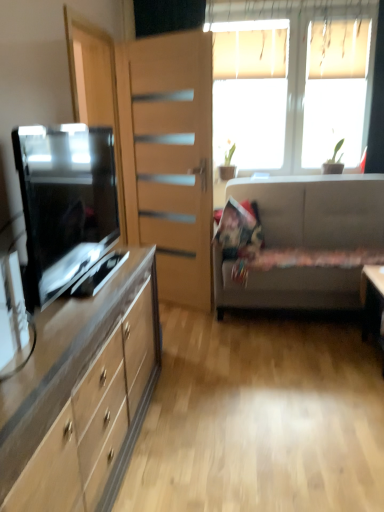
Identify the location of white fabric couch at right. (317, 210).

Describe the element at coordinates (317, 210) in the screenshot. I see `white fabric couch at right` at that location.

At what (x,y) coordinates should I click in order to perform the action: click on matte wood file cabinet at left. Please return your answer as a coordinate pair (x, y). Image resolution: width=384 pixels, height=512 pixels. Looking at the image, I should click on (169, 158).

I want to click on green matte plant at upper center, so click(227, 164).

This screenshot has width=384, height=512. What do you see at coordinates (82, 396) in the screenshot?
I see `matte wood cabinet at left` at bounding box center [82, 396].

Where is `white plastic window at upper right`? This screenshot has width=384, height=512. white plastic window at upper right is located at coordinates (302, 53).

From the image's perspective, is green matte plant at upper center above or below white fabric couch at right?

Based on their image positions, green matte plant at upper center is located above white fabric couch at right.

Is green matte plant at upper center thinner than white fabric couch at right?

Indeed, green matte plant at upper center has a lesser width compared to white fabric couch at right.

Is green matte plant at upper center turned away from white fabric couch at right?

No, green matte plant at upper center is not facing the opposite direction of white fabric couch at right.

I want to click on studio couch lying in front of the green matte plant at upper center, so click(317, 210).

Based on their positions, is matte wood file cabinet at left located to the left or right of matte black tv at left?

matte wood file cabinet at left is positioned on matte black tv at left's right side.

Are matte wood file cabinet at left and matte black tv at left beside each other?

matte wood file cabinet at left and matte black tv at left are clearly separated.

From the picture: Is matte wood file cabinet at left positioned beyond the bounds of matte black tv at left?

Yes.

Is matte wood file cabinet at left bigger than matte black tv at left?

Correct, matte wood file cabinet at left is larger in size than matte black tv at left.

Is white plastic window at upper right positioned with its back to fluffy fabric pillow at center?

No, white plastic window at upper right's orientation is not away from fluffy fabric pillow at center.

Considering the positions of objects white plastic window at upper right and fluffy fabric pillow at center in the image provided, who is more to the left, white plastic window at upper right or fluffy fabric pillow at center?

Positioned to the left is fluffy fabric pillow at center.

How far apart are white plastic window at upper right and fluffy fabric pillow at center?

4.33 feet.

Where is `file cabinet located on the left of white plastic window at upper right`? The image size is (384, 512). file cabinet located on the left of white plastic window at upper right is located at coordinates (169, 158).

Would you say matte wood file cabinet at left is part of white plastic window at upper right's contents?

No, matte wood file cabinet at left is located outside of white plastic window at upper right.

In terms of height, does white plastic window at upper right look taller or shorter compared to matte wood file cabinet at left?

Considering their sizes, white plastic window at upper right has less height than matte wood file cabinet at left.

Can you see white plastic window at upper right touching matte wood file cabinet at left?

No, white plastic window at upper right is not next to matte wood file cabinet at left.

Find the location of a particular element. The image size is (384, 512). file cabinet to the left of fluffy fabric pillow at center is located at coordinates (169, 158).

Does matte wood file cabinet at left have a lesser height compared to fluffy fabric pillow at center?

No, matte wood file cabinet at left is not shorter than fluffy fabric pillow at center.

From the image's perspective, which is below, matte wood file cabinet at left or fluffy fabric pillow at center?

fluffy fabric pillow at center.

Is matte wood file cabinet at left facing towards fluffy fabric pillow at center?

No, matte wood file cabinet at left is not turned towards fluffy fabric pillow at center.

Between white plastic window at upper right and white fabric couch at right, which one appears on the right side from the viewer's perspective?

Positioned to the right is white fabric couch at right.

From a real-world perspective, is white plastic window at upper right positioned above or below white fabric couch at right?

white plastic window at upper right is situated higher than white fabric couch at right in the real world.

From the image's perspective, which one is positioned lower, white plastic window at upper right or white fabric couch at right?

white fabric couch at right is shown below in the image.

Which point is more forward, [310,75] or [274,294]?

The point [274,294] is closer to the camera.

Which is behind, green matte plant at upper center or matte wood cabinet at left?

green matte plant at upper center is behind.

Is green matte plant at upper center oriented towards matte wood cabinet at left?

Yes.

Is green matte plant at upper center surrounding matte wood cabinet at left?

No, matte wood cabinet at left is not inside green matte plant at upper center.

Find the location of a particular element. houseplant that appears above the matte wood cabinet at left (from the image's perspective) is located at coordinates (227, 164).

At what (x,y) coordinates should I click in order to perform the action: click on studio couch lying in front of the green matte plant at upper center. Please return your answer as a coordinate pair (x, y). This screenshot has height=512, width=384. Looking at the image, I should click on (317, 210).

Locate an element on the screen. The width and height of the screenshot is (384, 512). file cabinet that appears on the right of matte black tv at left is located at coordinates (169, 158).

When comparing their distances from green matte plant at upper center, does matte wood cabinet at left or fluffy fabric pillow at center seem closer?

fluffy fabric pillow at center is positioned closer to the anchor green matte plant at upper center.

Looking at the image, which one is located further to matte wood cabinet at left, matte wood file cabinet at left or white plastic window at upper right?

The object further to matte wood cabinet at left is white plastic window at upper right.

From the image, which object appears to be nearer to fluffy fabric pillow at center, matte wood file cabinet at left or white fabric couch at right?

white fabric couch at right.

When comparing their distances from matte black tv at left, does white plastic window at upper right or matte wood cabinet at left seem closer?

matte wood cabinet at left is closer to matte black tv at left.

Which object lies further to the anchor point matte black tv at left, fluffy fabric pillow at center or matte wood cabinet at left?

Among the two, fluffy fabric pillow at center is located further to matte black tv at left.

From the image, which object appears to be farther from white plastic window at upper right, white fabric couch at right or green matte plant at upper center?

green matte plant at upper center is positioned further to the anchor white plastic window at upper right.

When comparing their distances from matte black tv at left, does white plastic window at upper right or green matte plant at upper center seem further?

The object further to matte black tv at left is white plastic window at upper right.

Based on their spatial positions, is matte wood cabinet at left or green matte plant at upper center closer to matte wood file cabinet at left?

green matte plant at upper center.

I want to click on studio couch between matte black tv at left and matte wood file cabinet at left in the front-back direction, so click(317, 210).

Find the location of a particular element. window between matte black tv at left and green matte plant at upper center in the front-back direction is located at coordinates (302, 53).

Locate an element on the screen. This screenshot has height=512, width=384. television between matte wood cabinet at left and matte wood file cabinet at left in the front-back direction is located at coordinates (66, 201).

Locate an element on the screen. The height and width of the screenshot is (512, 384). file cabinet between matte black tv at left and white plastic window at upper right along the z-axis is located at coordinates (169, 158).